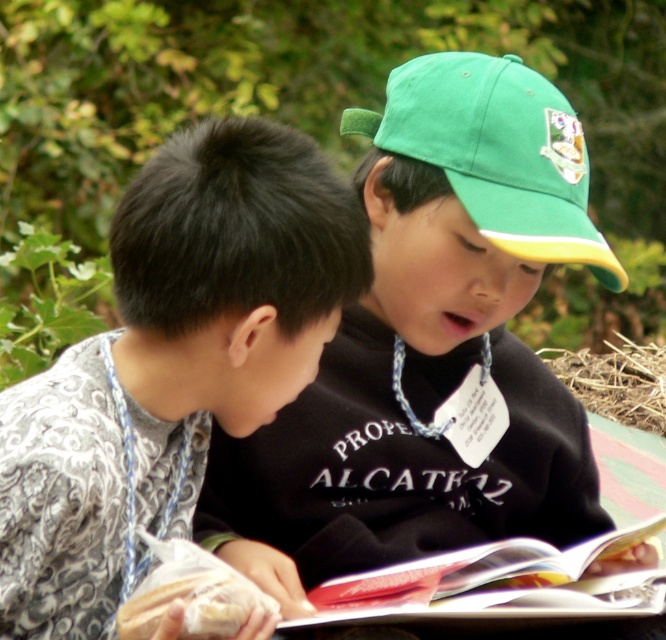
Who is positioned more to the left, green fabric cap at upper right or green fabric baseball cap at upper right?

green fabric cap at upper right is more to the left.

Can you confirm if green fabric cap at upper right is taller than green fabric baseball cap at upper right?

Correct, green fabric cap at upper right is much taller as green fabric baseball cap at upper right.

The image size is (666, 640). What are the coordinates of `green fabric cap at upper right` in the screenshot? It's located at (428, 346).

Find the location of `green fabric cap at upper right`. green fabric cap at upper right is located at coordinates (428, 346).

Can you confirm if gray patterned shirt at left is smaller than green fabric baseball cap at upper right?

No.

This screenshot has height=640, width=666. I want to click on gray patterned shirt at left, so click(x=170, y=362).

The width and height of the screenshot is (666, 640). I want to click on gray patterned shirt at left, so click(x=170, y=362).

Locate an element on the screen. gray patterned shirt at left is located at coordinates (170, 362).

Between point (601, 582) and point (595, 381), which one is positioned behind?

The point (595, 381) is behind.

Which of these two, paperback book at center or brown straw at lower right, stands shorter?

paperback book at center is shorter.

Is point (452, 589) positioned in front of point (545, 362)?

Yes, point (452, 589) is in front of point (545, 362).

Locate an element on the screen. paperback book at center is located at coordinates (488, 582).